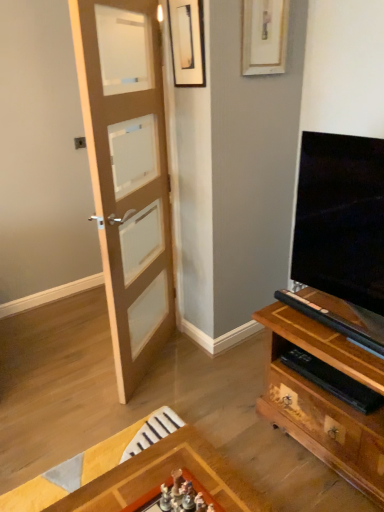
Find the location of `vacant area situated to the left side of light brown wooden door at left`. vacant area situated to the left side of light brown wooden door at left is located at coordinates (71, 367).